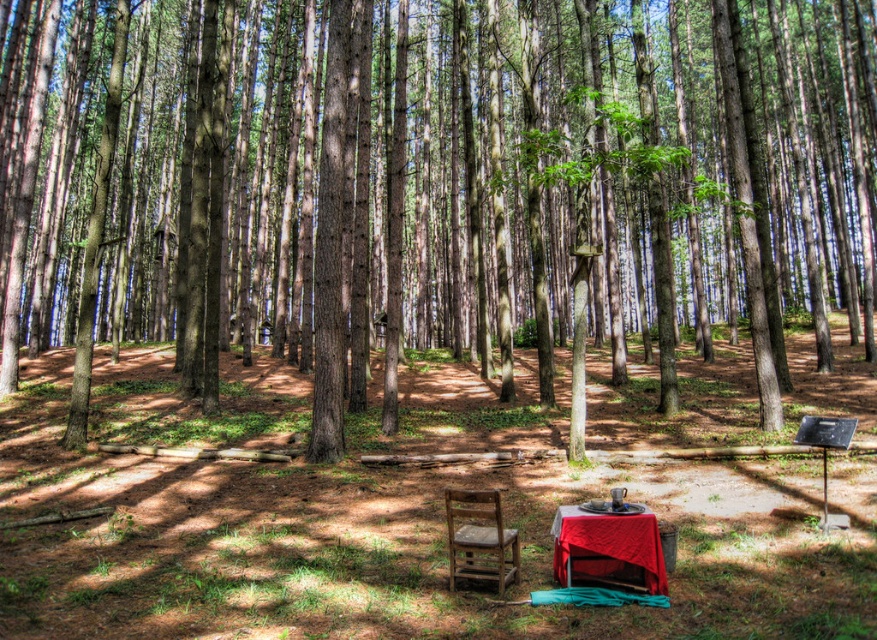
Based on the photo, is brown wood tree at center to the right of wooden chair at center from the viewer's perspective?

Indeed, brown wood tree at center is positioned on the right side of wooden chair at center.

Which is in front, point (254, 234) or point (492, 563)?

Positioned in front is point (492, 563).

Where is `brown wood tree at center`? brown wood tree at center is located at coordinates (436, 188).

Between brown wood tree at center and red cloth-covered table at center, which one appears on the right side from the viewer's perspective?

brown wood tree at center

Is point (264, 176) more distant than point (567, 580)?

Yes, it is.

Between point (535, 237) and point (640, 524), which one is positioned in front?

Point (640, 524)

This screenshot has width=877, height=640. I want to click on brown wood tree at center, so click(436, 188).

Does red cloth-covered table at center have a larger size compared to wooden chair at center?

No, red cloth-covered table at center is not bigger than wooden chair at center.

Which is more to the right, red cloth-covered table at center or wooden chair at center?

red cloth-covered table at center

Image resolution: width=877 pixels, height=640 pixels. In order to click on red cloth-covered table at center in this screenshot , I will do `click(608, 548)`.